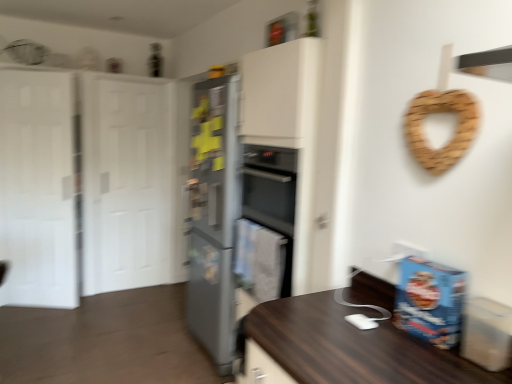
You are a GUI agent. You are given a task and a screenshot of the screen. Output one action in this format:
    pyautogui.click(x=<x>, y=<y>)
    Task: Click on the free space above white glossy door at left, which ranks as the 2th glass door in front-to-back order (from a real-world perspective)
    The width and height of the screenshot is (512, 384).
    Given the screenshot: What is the action you would take?
    pyautogui.click(x=131, y=79)